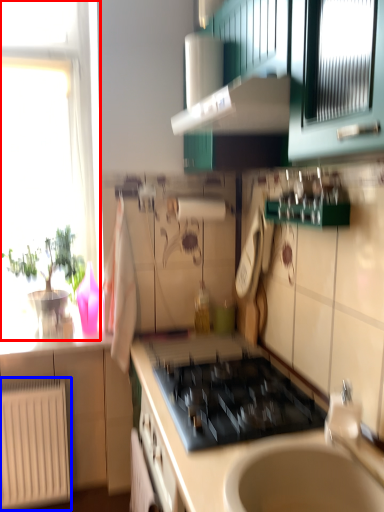
Question: Which object is closer to the camera taking this photo, window (highlighted by a red box) or radiator (highlighted by a blue box)?

Choices:
 (A) window
 (B) radiator

Answer: (B)